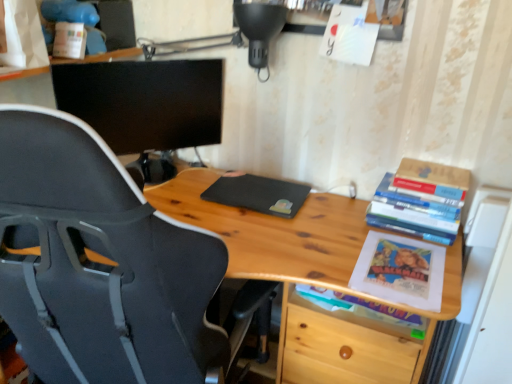
You are a GUI agent. You are given a task and a screenshot of the screen. Output one action in this format:
    pyautogui.click(x=<x>, y=<y>)
    Task: Click on the empty space that is to the right of black matte laptop at center
    This screenshot has width=512, height=384.
    Given the screenshot: What is the action you would take?
    pyautogui.click(x=336, y=215)